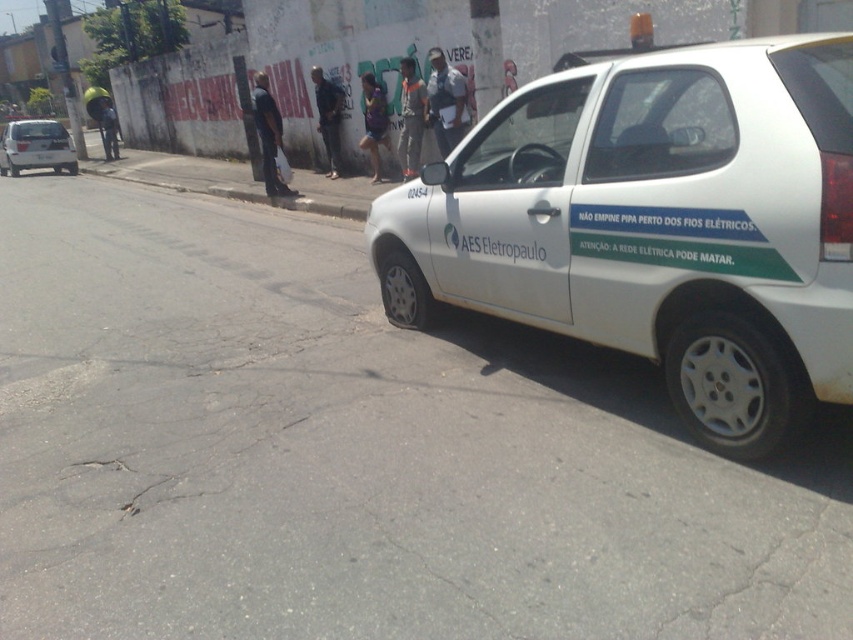
Question: Considering the relative positions of white matte car at right and white matte car at left in the image provided, where is white matte car at right located with respect to white matte car at left?

Choices:
 (A) below
 (B) above

Answer: (A)

Question: Among these points, which one is farthest from the camera?

Choices:
 (A) (7, 157)
 (B) (830, 97)

Answer: (A)

Question: Is white matte car at right above white matte car at left?

Choices:
 (A) yes
 (B) no

Answer: (B)

Question: Is white matte car at right wider than white matte car at left?

Choices:
 (A) yes
 (B) no

Answer: (B)